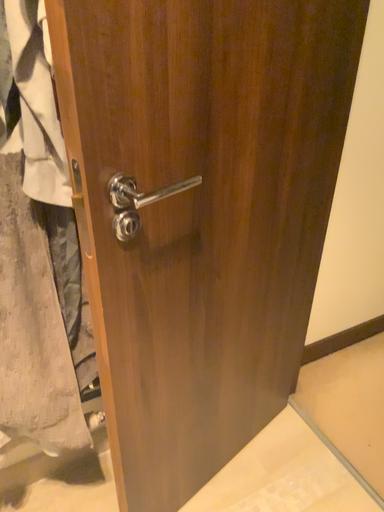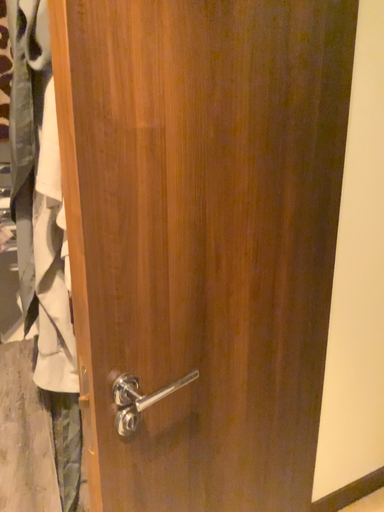
Question: How did the camera likely rotate when shooting the video?

Choices:
 (A) rotated downward
 (B) rotated upward

Answer: (B)